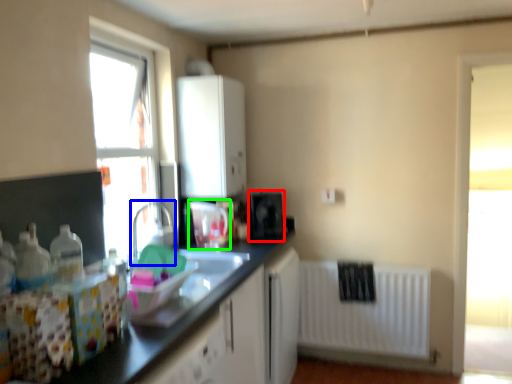
Question: Which object is the closest to the appliance (highlighted by a red box)? Choose among these: faucet (highlighted by a blue box) or appliance (highlighted by a green box).

Choices:
 (A) faucet
 (B) appliance

Answer: (B)